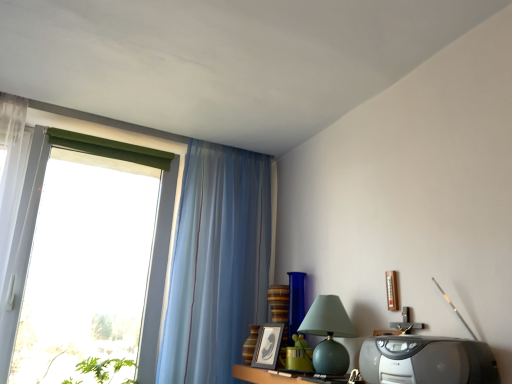
Question: Based on their sizes in the image, would you say wooden table at lower center is bigger or smaller than translucent blue curtain at left?

Choices:
 (A) big
 (B) small

Answer: (B)

Question: In terms of width, does wooden table at lower center look wider or thinner when compared to translucent blue curtain at left?

Choices:
 (A) thin
 (B) wide

Answer: (B)

Question: Which object is the closest to the striped glass vase at center, acting as the 2th glass vase starting from the right?

Choices:
 (A) translucent blue curtain at left
 (B) transparent glass window at left
 (C) blue glass vase at center, acting as the first glass vase starting from the right
 (D) wooden table at lower center
 (E) striped ceramic vase at center

Answer: (D)

Question: Based on their relative distances, which object is farther from the matte green glass table lamp at center-right?

Choices:
 (A) black matte picture frame at center
 (B) wooden table at lower center
 (C) blue glass vase at center, the 2th glass vase when ordered from left to right
 (D) striped glass vase at center, the first glass vase from the left
 (E) striped ceramic vase at center

Answer: (D)